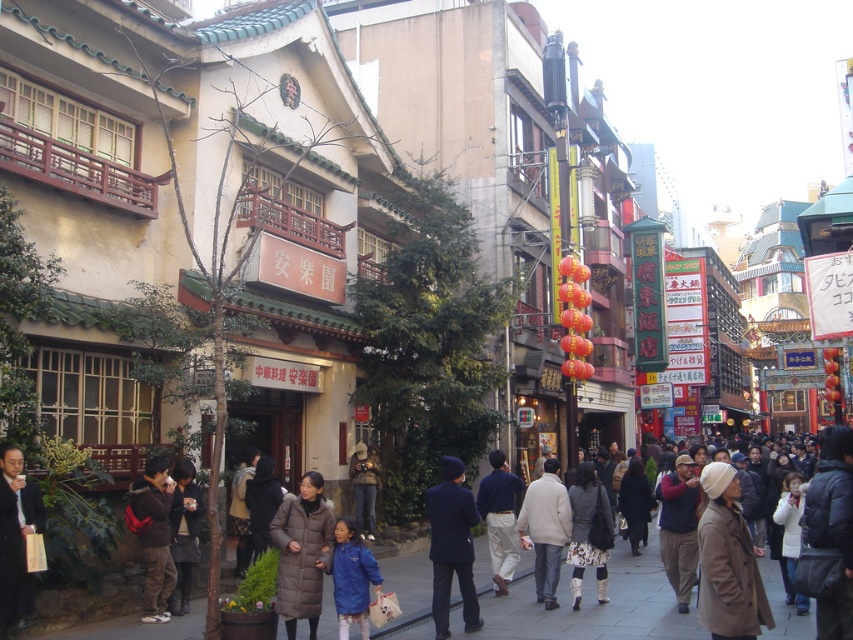
Question: Which of the following is the closest to the observer?

Choices:
 (A) (721, 481)
 (B) (178, 499)
 (C) (670, 545)
 (D) (334, 596)

Answer: (A)

Question: Which is nearer to the navy blue suit at center?

Choices:
 (A) dark blue jacket at center
 (B) white textured pants at center

Answer: (B)

Question: Is light gray wool coat at center positioned in front of dark brown leather jacket at lower left?

Choices:
 (A) no
 (B) yes

Answer: (A)

Question: Is navy blue suit at center smaller than light blue cotton shirt at center?

Choices:
 (A) no
 (B) yes

Answer: (A)

Question: Can you confirm if matte gray coat at center is positioned below dark blue jacket at center?

Choices:
 (A) yes
 (B) no

Answer: (B)

Question: Which object is closer to the camera taking this photo?

Choices:
 (A) dark brown backpack at lower left
 (B) light gray wool coat at center

Answer: (A)